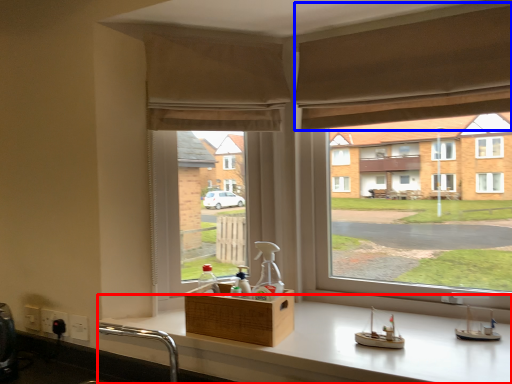
Question: Among these objects, which one is nearest to the camera, counter (highlighted by a red box) or curtain (highlighted by a blue box)?

Choices:
 (A) counter
 (B) curtain

Answer: (A)